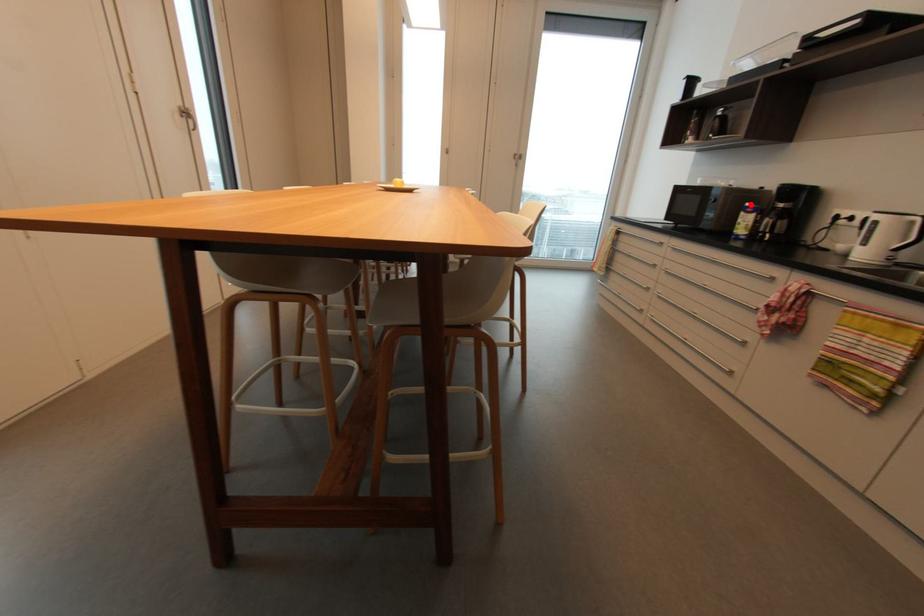
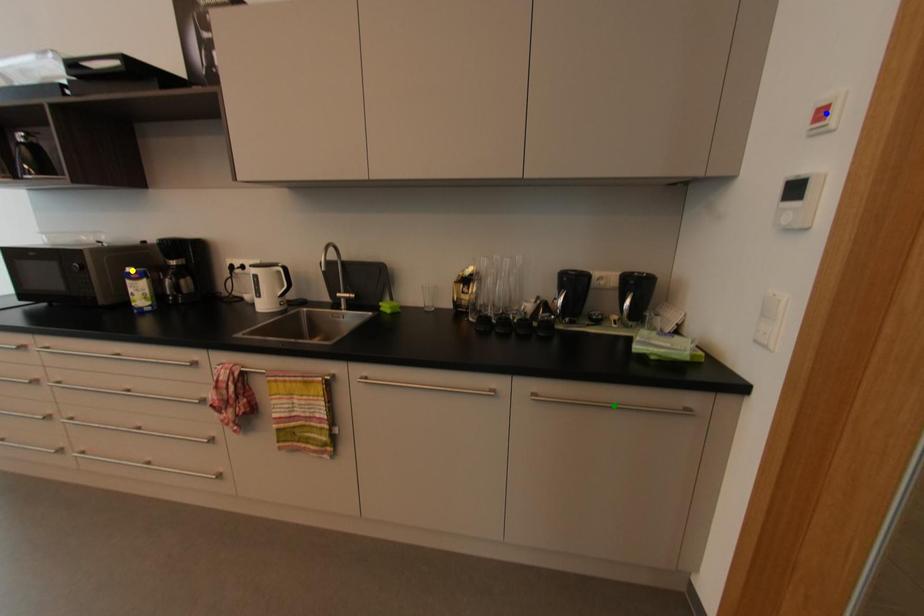
Question: I am providing you with two images of the same scene from different viewpoints. A red point is marked on the first image. You are given multiple points on the second image. Which point in image 2 represents the same 3d spot as the red point in image 1?

Choices:
 (A) yellow point
 (B) green point
 (C) blue point

Answer: (A)